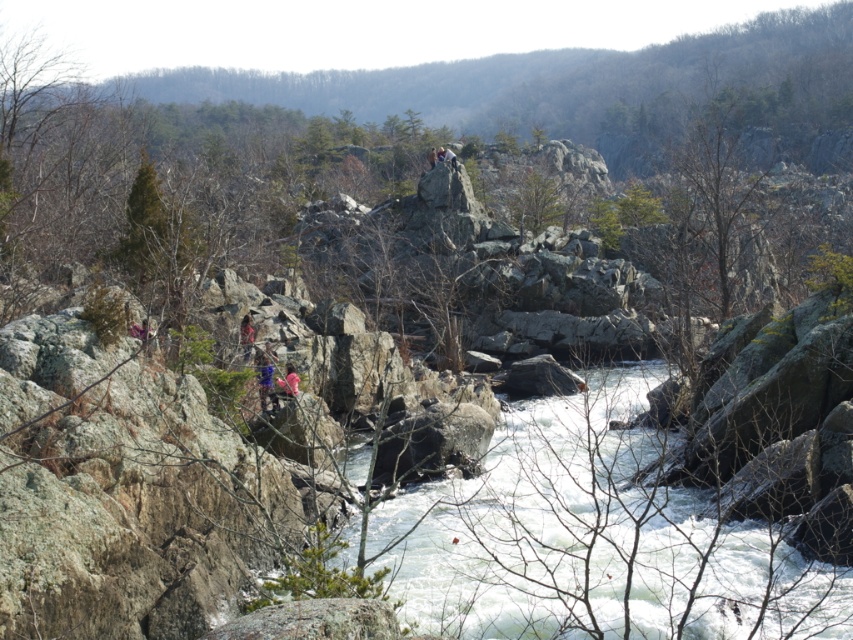
Measure the distance between point (264, 371) and camera.

Point (264, 371) and camera are 108.19 feet apart.

Does blue fabric person at center appear on the right side of matte pink shirt at center?

Indeed, blue fabric person at center is positioned on the right side of matte pink shirt at center.

Find the location of `blue fabric person at center`. blue fabric person at center is located at coordinates (265, 380).

Identify the location of blue fabric person at center. The image size is (853, 640). point(265,380).

Does white frothy water at center have a greater height compared to matte pink shirt at center?

Indeed, white frothy water at center has a greater height compared to matte pink shirt at center.

Does white frothy water at center appear under matte pink shirt at center?

Correct, white frothy water at center is located below matte pink shirt at center.

Is point (589, 529) more distant than point (251, 339)?

No, it is in front of (251, 339).

Where is `white frothy water at center`? The width and height of the screenshot is (853, 640). white frothy water at center is located at coordinates (590, 538).

Does white frothy water at center have a greater width compared to blue fabric person at center?

Yes, white frothy water at center is wider than blue fabric person at center.

Is point (515, 611) more distant than point (267, 385)?

No, (515, 611) is in front of (267, 385).

The width and height of the screenshot is (853, 640). What are the coordinates of `white frothy water at center` in the screenshot? It's located at (590, 538).